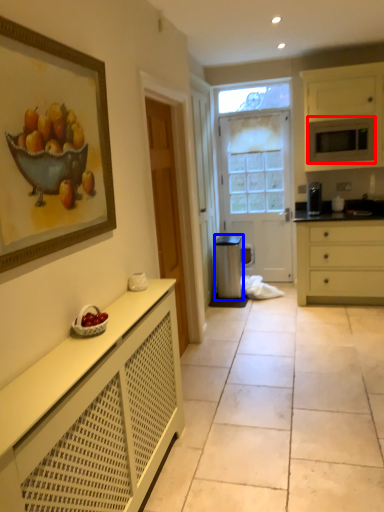
Question: Which point is closer to the camera, microwave oven (highlighted by a red box) or appliance (highlighted by a blue box)?

Choices:
 (A) microwave oven
 (B) appliance

Answer: (A)